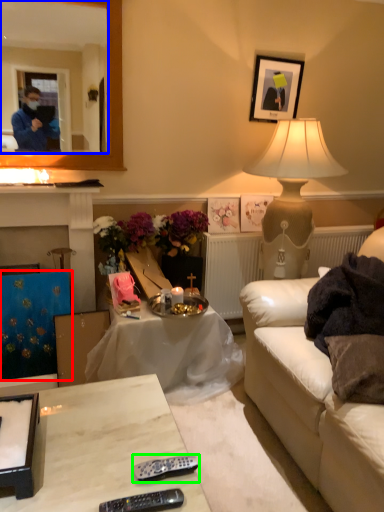
Question: Based on their relative distances, which object is farther from curtain (highlighted by a red box)? Choose from mirror (highlighted by a blue box) and remote (highlighted by a green box).

Choices:
 (A) mirror
 (B) remote

Answer: (B)